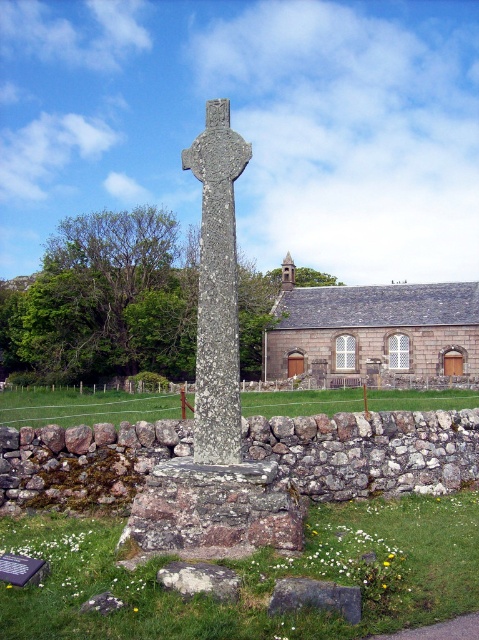
You are a photographer positioned at the center of the scene. You want to take a photo of the granite cross at center. Where should you aim your camera to capture it in the frame?

You should aim your camera at the point with coordinates 0.622 on the x axis and 0.451 on the y axis to capture the granite cross at center in the frame.

You are a landscape architect designing a pathway between the rough stone cross at center and the gray rough stone at lower center. The pathway must be exactly 2 meters long. Is this possible given their current positions?

The rough stone cross at center is 2.48 meters from the gray rough stone at lower center. Since the required pathway length is 2 meters, which is shorter than the existing distance between them, it is not possible to create a 2 meter pathway between them.